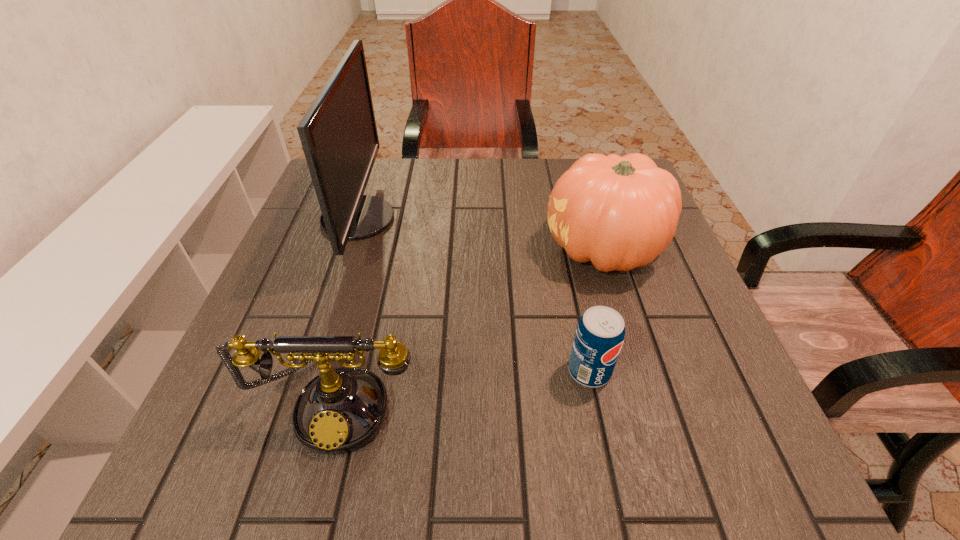
The image size is (960, 540). In the image, there is a desktop. Find the location of `free space at the near left corner`. free space at the near left corner is located at coordinates (283, 484).

Where is `vacant space at the near right corner`? This screenshot has width=960, height=540. vacant space at the near right corner is located at coordinates (788, 479).

Find the location of a particular element. This screenshot has height=540, width=960. empty space that is in between the pumpkin and the tallest object is located at coordinates (481, 234).

Find the location of `vacant area between the monitor and the pop`. vacant area between the monitor and the pop is located at coordinates coord(473,295).

Identify the location of free spot between the telephone and the monitor. (348, 309).

This screenshot has height=540, width=960. In order to click on empty location between the pumpkin and the telephone in this screenshot , I will do `click(472, 325)`.

Locate an element on the screen. The height and width of the screenshot is (540, 960). empty space that is in between the telephone and the shortest object is located at coordinates pyautogui.click(x=465, y=386).

The width and height of the screenshot is (960, 540). Identify the location of free space between the telephone and the pop. (465, 386).

Where is `unoccupied position between the telephone and the pumpkin`? The width and height of the screenshot is (960, 540). unoccupied position between the telephone and the pumpkin is located at coordinates (472, 325).

The height and width of the screenshot is (540, 960). Identify the location of free space between the pumpkin and the telephone. (472, 325).